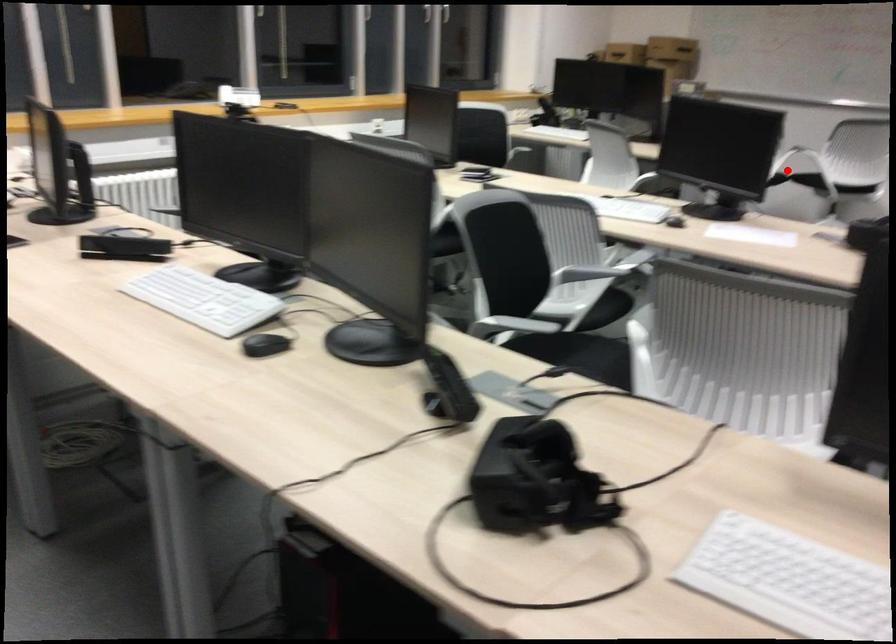
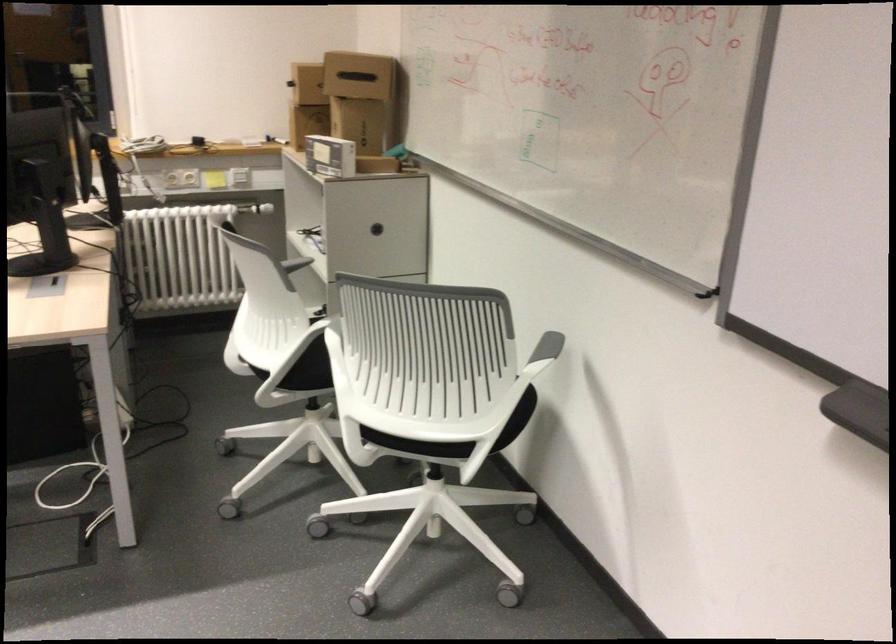
Locate, in the second image, the point that corresponds to the highlighted location in the first image.

(307, 375)